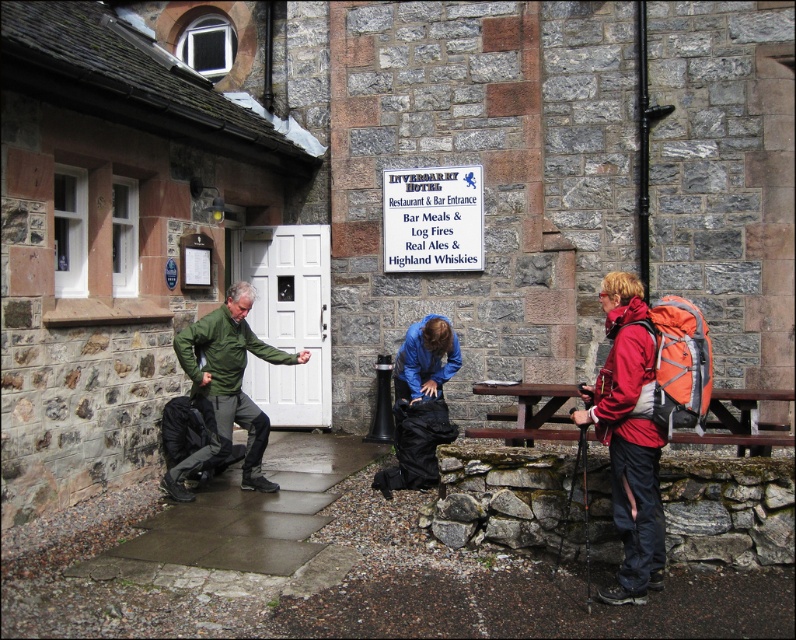
Question: Which is farther from the white plastic sign at upper center?

Choices:
 (A) brown wooden picnic table at center
 (B) matte red jacket at right
 (C) wooden picnic table at center

Answer: (B)

Question: Can you confirm if matte red jacket at right is positioned to the left of wooden picnic table at center?

Choices:
 (A) no
 (B) yes

Answer: (B)

Question: Among these points, which one is nearest to the camera?

Choices:
 (A) (621, 580)
 (B) (523, 436)
 (C) (412, 237)

Answer: (A)

Question: Does white plastic sign at upper center have a greater width compared to wooden picnic table at center?

Choices:
 (A) no
 (B) yes

Answer: (A)

Question: Observing the image, what is the correct spatial positioning of green matte jacket at center in reference to wooden picnic table at center?

Choices:
 (A) right
 (B) left

Answer: (B)

Question: Which point is closer to the camera taking this photo?

Choices:
 (A) (248, 435)
 (B) (478, 387)

Answer: (A)